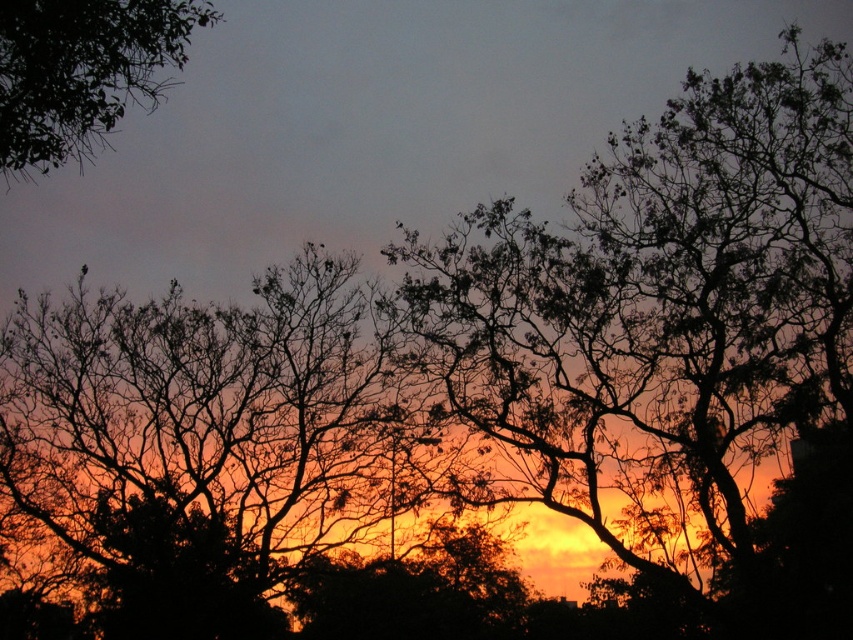
Which of these two, silhouette tree at upper right or green leafy tree at upper left, stands shorter?

green leafy tree at upper left

Who is more forward, (582, 464) or (167, 81)?

Point (167, 81)

I want to click on silhouette tree at upper right, so click(679, 330).